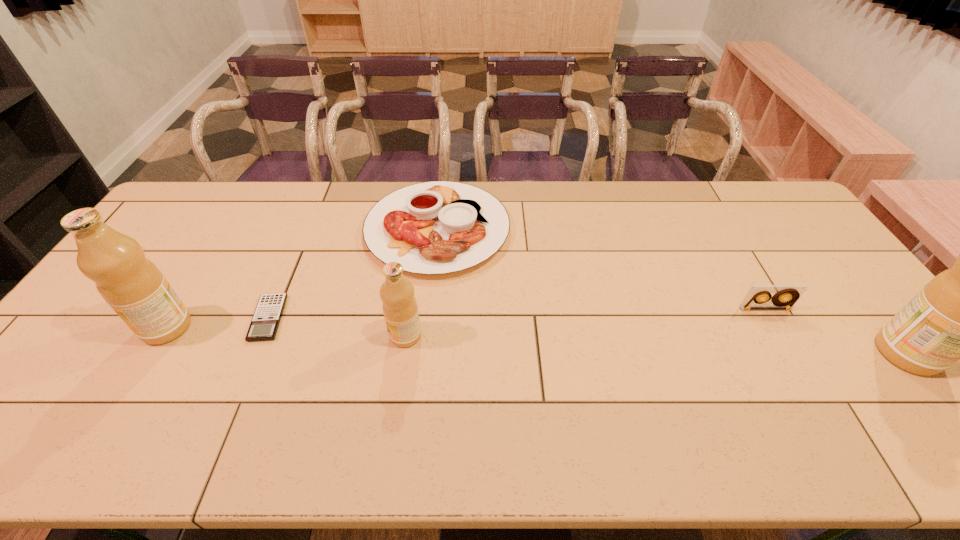
Find the location of a particular element. vacant area that lies between the rightmost object and the second shortest object is located at coordinates (672, 291).

Locate an element on the screen. This screenshot has height=540, width=960. vacant space in between the third tallest object and the leftmost olive oil is located at coordinates (286, 332).

In order to click on free space between the farthest object and the second object from right to left in this screenshot , I will do `click(601, 269)`.

At what (x,y) coordinates should I click in order to perform the action: click on vacant space that's between the leftmost olive oil and the rightmost olive oil. Please return your answer as a coordinate pair (x, y). Looking at the image, I should click on (537, 340).

What are the coordinates of `vacant region between the third shortest object and the leftmost object` in the screenshot? It's located at (466, 318).

Identify the location of free point between the second shortest olive oil and the rightmost olive oil. Image resolution: width=960 pixels, height=540 pixels. (537, 340).

At what (x,y) coordinates should I click in order to perform the action: click on free point between the second shortest object and the second olive oil from left to right. Please return your answer as a coordinate pair (x, y). Looking at the image, I should click on (421, 282).

The image size is (960, 540). Identify the location of object identified as the second closest to the rightmost object. (437, 227).

Identify which object is the third closest to the shortest object. Please provide its 2D coordinates. Your answer should be formatted as a tuple, i.e. [(x, y)], where the tuple contains the x and y coordinates of a point satisfying the conditions above.

[(400, 309)]

The height and width of the screenshot is (540, 960). I want to click on olive oil that is the closest one to the fourth shortest object, so click(x=133, y=286).